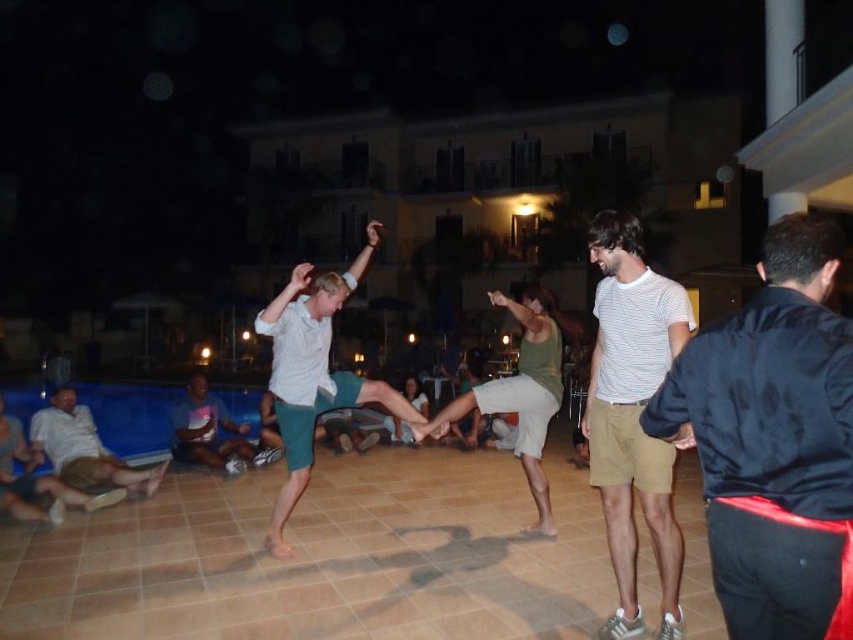
Can you confirm if dark blue satin jacket at right is smaller than striped cotton shirt at center?

Yes.

The height and width of the screenshot is (640, 853). What do you see at coordinates (775, 442) in the screenshot?
I see `dark blue satin jacket at right` at bounding box center [775, 442].

Is point (793, 500) farther from viewer compared to point (631, 573)?

No.

Identify the location of dark blue satin jacket at right. Image resolution: width=853 pixels, height=640 pixels. (775, 442).

Measure the distance between dark blue satin jacket at right and camera.

1.43 meters

Can you confirm if dark blue satin jacket at right is positioned below light brown fabric shorts at lower left?

Incorrect, dark blue satin jacket at right is not positioned below light brown fabric shorts at lower left.

This screenshot has height=640, width=853. In order to click on dark blue satin jacket at right in this screenshot , I will do `click(775, 442)`.

Between point (741, 385) and point (268, 451), which one is positioned in front?

Positioned in front is point (741, 385).

Between point (781, 397) and point (186, 422), which one is positioned behind?

Positioned behind is point (186, 422).

Image resolution: width=853 pixels, height=640 pixels. In order to click on dark blue satin jacket at right in this screenshot , I will do `click(775, 442)`.

Where is `dark blue satin jacket at right`? Image resolution: width=853 pixels, height=640 pixels. dark blue satin jacket at right is located at coordinates (775, 442).